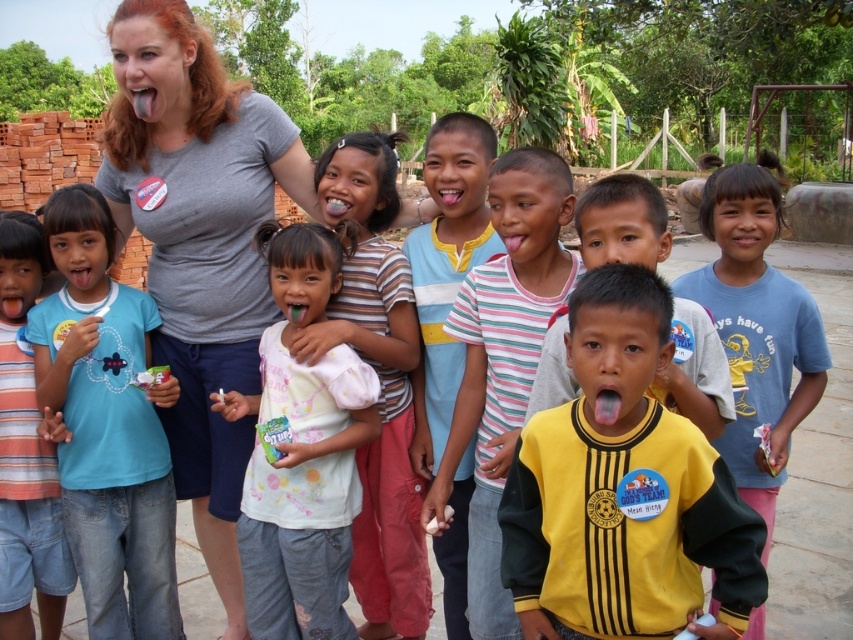
Which is more to the left, gray matte shirt at upper center or white cotton shirt at center?

Positioned to the left is gray matte shirt at upper center.

Which is behind, point (196, 188) or point (270, 358)?

The point (196, 188) is behind.

Where is `gray matte shirt at upper center`? The image size is (853, 640). gray matte shirt at upper center is located at coordinates (199, 243).

Between striped cotton shirt at center and blue cotton shirt at center, which one has less height?

With less height is striped cotton shirt at center.

Does point (498, 337) come farther from viewer compared to point (711, 198)?

No.

You are a GUI agent. You are given a task and a screenshot of the screen. Output one action in this format:
    pyautogui.click(x=<x>, y=<y>)
    Task: Click on the striped cotton shirt at center
    The image size is (853, 640).
    Given the screenshot: What is the action you would take?
    pyautogui.click(x=503, y=358)

Identify the location of striped cotton shirt at center. This screenshot has height=640, width=853. (503, 358).

Does blue cotton shirt at left appear on the right side of blue striped shirt at center?

Indeed, blue cotton shirt at left is positioned on the right side of blue striped shirt at center.

The width and height of the screenshot is (853, 640). Find the location of `blue cotton shirt at left`. blue cotton shirt at left is located at coordinates [x=107, y=426].

The width and height of the screenshot is (853, 640). In order to click on blue cotton shirt at left in this screenshot , I will do `click(107, 426)`.